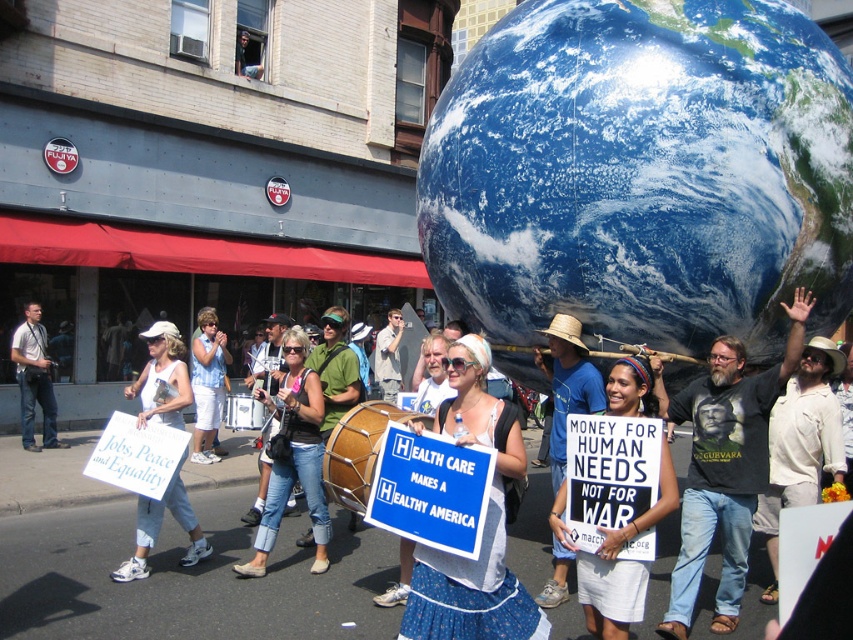
Does blue glossy earth at upper center have a smaller size compared to blue denim shorts at center?

No.

Is point (479, 173) behind point (200, 412)?

No, it is in front of (200, 412).

Image resolution: width=853 pixels, height=640 pixels. In order to click on blue glossy earth at upper center in this screenshot , I will do pyautogui.click(x=642, y=173).

Which of these two, beige cotton shirt at center or white fabric sign at lower left, stands shorter?

Standing shorter between the two is white fabric sign at lower left.

Which is in front, point (671, 600) or point (138, 384)?

Point (671, 600) is in front.

Locate an element on the screen. This screenshot has height=640, width=853. beige cotton shirt at center is located at coordinates (723, 467).

Does blue glossy earth at upper center have a greater height compared to white cotton shorts at lower center?

Indeed, blue glossy earth at upper center has a greater height compared to white cotton shorts at lower center.

Can you confirm if blue glossy earth at upper center is positioned to the right of white cotton shorts at lower center?

Indeed, blue glossy earth at upper center is positioned on the right side of white cotton shorts at lower center.

Which is behind, point (717, 145) or point (602, 554)?

The point (717, 145) is more distant.

Locate an element on the screen. blue glossy earth at upper center is located at coordinates (642, 173).